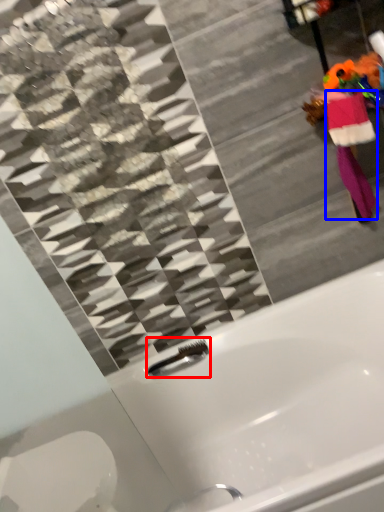
Question: Which point is closer to the camera, faucet (highlighted by a red box) or robe (highlighted by a blue box)?

Choices:
 (A) faucet
 (B) robe

Answer: (B)